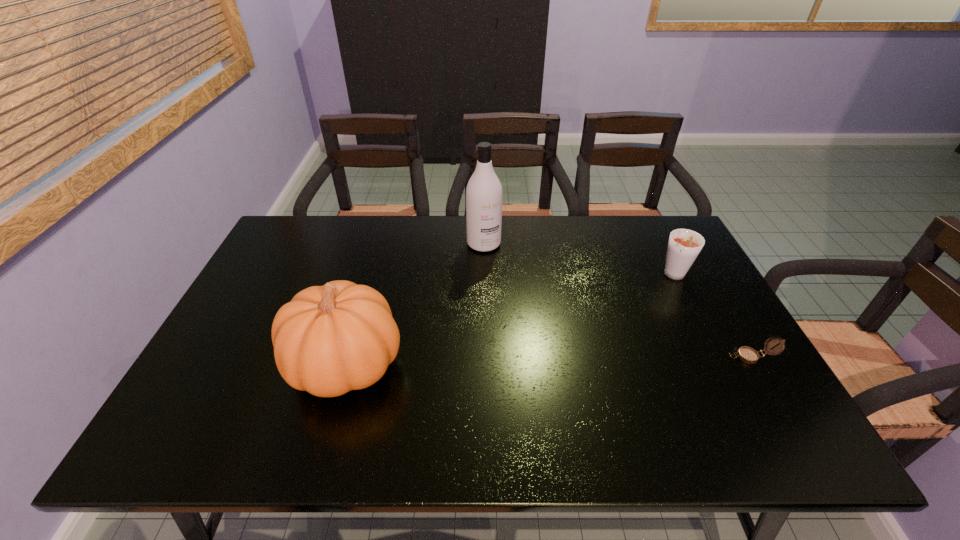
You are a GUI agent. You are given a task and a screenshot of the screen. Output one action in this format:
    pyautogui.click(x=<x>, y=<y>)
    Task: Click on the third shortest object
    This screenshot has width=960, height=540.
    Given the screenshot: What is the action you would take?
    pyautogui.click(x=328, y=340)

Image resolution: width=960 pixels, height=540 pixels. In order to click on pumpkin in this screenshot , I will do `click(328, 340)`.

Where is `the shortest object`? The width and height of the screenshot is (960, 540). the shortest object is located at coordinates (748, 355).

This screenshot has height=540, width=960. I want to click on root beer, so click(684, 245).

Identify the location of the third nearest object. The image size is (960, 540). [x=684, y=245].

The height and width of the screenshot is (540, 960). I want to click on the tallest object, so click(484, 191).

Locate an element on the screen. the farthest object is located at coordinates pyautogui.click(x=484, y=191).

The width and height of the screenshot is (960, 540). In order to click on vacant area located 0.250m on the back of the leftmost object in this screenshot , I will do `click(375, 262)`.

Where is `vacant space located on the face of the shortest object`? The height and width of the screenshot is (540, 960). vacant space located on the face of the shortest object is located at coordinates (621, 357).

Find the location of `free location located on the face of the shortest object`. free location located on the face of the shortest object is located at coordinates (654, 357).